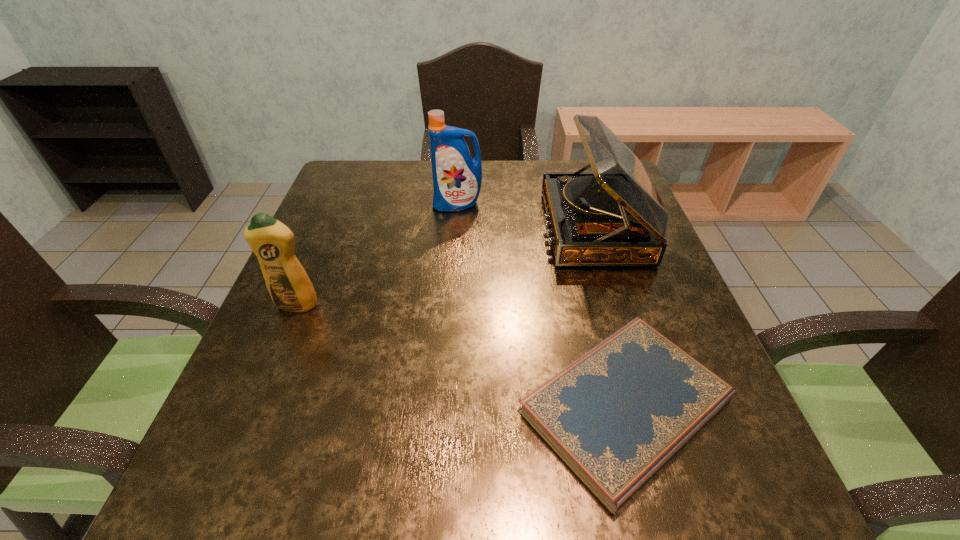
In order to click on vacant space positioned on the front-facing side of the record player in this screenshot , I will do `click(393, 227)`.

This screenshot has width=960, height=540. What are the coordinates of `vacant space located 0.110m on the label of the nearer detergent` in the screenshot? It's located at (275, 358).

I want to click on free space located on the left of the shortest object, so click(x=340, y=406).

Locate an element on the screen. Image resolution: width=960 pixels, height=540 pixels. detergent at the far edge is located at coordinates (457, 178).

Locate an element on the screen. This screenshot has height=540, width=960. record player located in the far edge section of the desktop is located at coordinates (614, 216).

You are a GUI agent. You are given a task and a screenshot of the screen. Output one action in this format:
    pyautogui.click(x=<x>, y=<y>)
    Task: Click on the object situated at the near edge
    The height and width of the screenshot is (540, 960).
    Given the screenshot: What is the action you would take?
    pyautogui.click(x=615, y=416)

This screenshot has width=960, height=540. In order to click on object that is at the left edge in this screenshot , I will do `click(289, 286)`.

I want to click on record player at the right edge, so click(614, 216).

Identify the location of paperback book that is at the right edge. The height and width of the screenshot is (540, 960). (615, 416).

Locate an element on the screen. The height and width of the screenshot is (540, 960). object present at the far right corner is located at coordinates (614, 216).